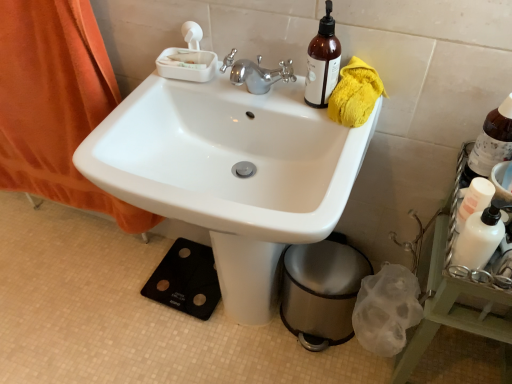
Question: Does metallic trash can at lower right appear on the left side of white matte bottle at right?

Choices:
 (A) yes
 (B) no

Answer: (A)

Question: Is metallic trash can at lower right not inside white matte bottle at right?

Choices:
 (A) no
 (B) yes

Answer: (B)

Question: Is the position of metallic trash can at lower right more distant than that of white matte bottle at right?

Choices:
 (A) yes
 (B) no

Answer: (A)

Question: Does metallic trash can at lower right turn towards white matte bottle at right?

Choices:
 (A) yes
 (B) no

Answer: (B)

Question: From the image's perspective, is metallic trash can at lower right over white matte bottle at right?

Choices:
 (A) yes
 (B) no

Answer: (B)

Question: In terms of width, does white glossy lotion at right, which is counted as the first bottle, starting from the bottom, look wider or thinner when compared to brown glass bottle at upper right, marked as the third bottle in a right-to-left arrangement?

Choices:
 (A) thin
 (B) wide

Answer: (A)

Question: Considering the positions of white glossy lotion at right, which is the second bottle in left-to-right order, and brown glass bottle at upper right, marked as the third bottle in a right-to-left arrangement, in the image, is white glossy lotion at right, which is the second bottle in left-to-right order, bigger or smaller than brown glass bottle at upper right, marked as the third bottle in a right-to-left arrangement,?

Choices:
 (A) big
 (B) small

Answer: (B)

Question: From a real-world perspective, is white glossy lotion at right, marked as the third bottle in a top-to-bottom arrangement, physically located above or below brown glass bottle at upper right, marked as the third bottle in a right-to-left arrangement?

Choices:
 (A) above
 (B) below

Answer: (B)

Question: Is white glossy lotion at right, which is counted as the first bottle, starting from the bottom, inside the boundaries of brown glass bottle at upper right, which is the first bottle in left-to-right order, or outside?

Choices:
 (A) inside
 (B) outside

Answer: (B)

Question: Looking at the image, does metallic trash can at lower right seem bigger or smaller compared to brown glass bottle at upper right, which is the first bottle in left-to-right order?

Choices:
 (A) small
 (B) big

Answer: (B)

Question: Considering their positions, is metallic trash can at lower right located in front of or behind brown glass bottle at upper right, which is counted as the third bottle, starting from the bottom?

Choices:
 (A) behind
 (B) front

Answer: (A)

Question: From their relative heights in the image, would you say metallic trash can at lower right is taller or shorter than brown glass bottle at upper right, the first bottle in the top-to-bottom sequence?

Choices:
 (A) short
 (B) tall

Answer: (B)

Question: Is metallic trash can at lower right to the left or to the right of brown glass bottle at upper right, which is counted as the third bottle, starting from the bottom, in the image?

Choices:
 (A) right
 (B) left

Answer: (A)

Question: In terms of height, does white glossy sink at center look taller or shorter compared to orange fabric curtain at left?

Choices:
 (A) short
 (B) tall

Answer: (A)

Question: In terms of size, does white glossy sink at center appear bigger or smaller than orange fabric curtain at left?

Choices:
 (A) big
 (B) small

Answer: (A)